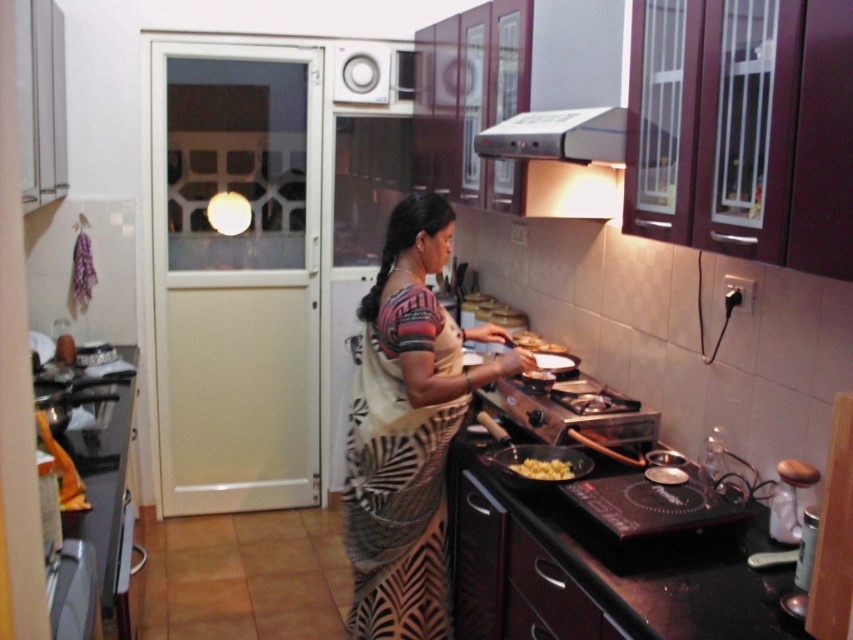
Question: Observing the image, what is the correct spatial positioning of printed cotton saree at center in reference to yellow matte food at lower center?

Choices:
 (A) below
 (B) above

Answer: (B)

Question: Can you confirm if silver metallic exhaust hood at upper center is bigger than yellow matte food at lower center?

Choices:
 (A) yes
 (B) no

Answer: (A)

Question: Which of the following is the farthest from the observer?

Choices:
 (A) silver metallic exhaust hood at upper center
 (B) yellow matte food at lower center

Answer: (B)

Question: In this image, where is silver metallic exhaust hood at upper center located relative to yellow matte food at lower center?

Choices:
 (A) below
 (B) above

Answer: (B)

Question: Which of the following is the farthest from the observer?

Choices:
 (A) (612, 154)
 (B) (407, 221)
 (C) (548, 476)

Answer: (B)

Question: Which object appears farthest from the camera in this image?

Choices:
 (A) yellow matte food at lower center
 (B) silver metallic exhaust hood at upper center

Answer: (A)